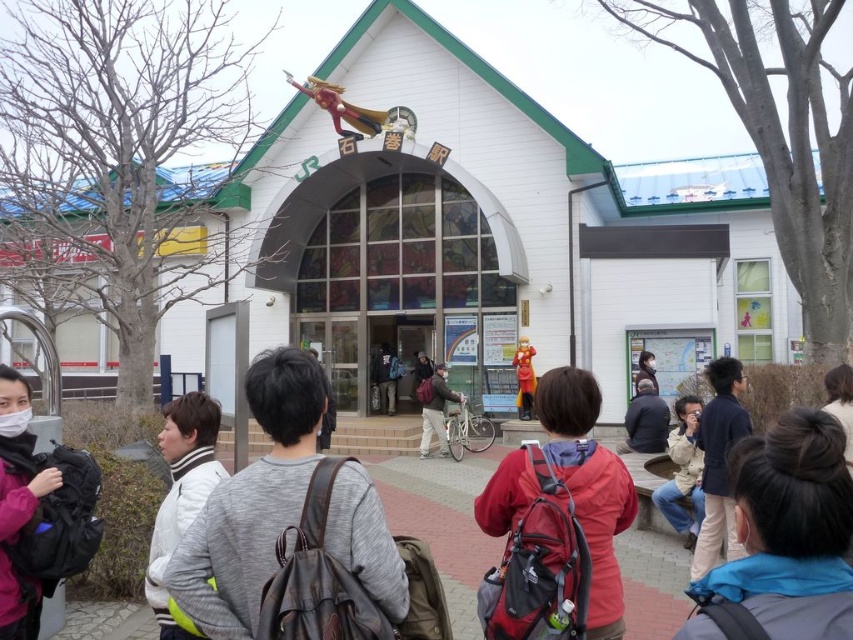
You are standing at the entrance of the train station in the image. You need to locate the gray fabric backpacks at center. According to the coordinates provided, where would you look to find them?

The gray fabric backpacks at center are located at coordinates point (x=281, y=515), which would be slightly to the right and above the center of the image.

You are standing at the entrance of the train station and see a red backpack at center. Where exactly is the red backpack located in relation to the entrance?

The red backpack at center is located at point (602, 529) in relation to the entrance.